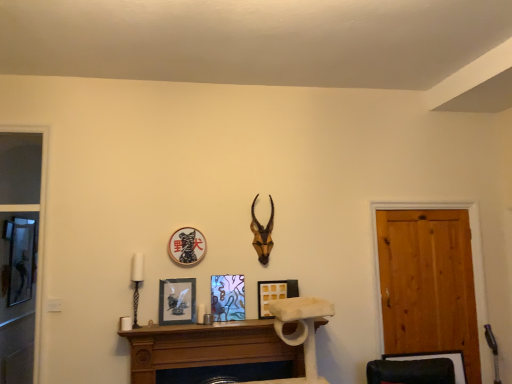
Question: Is brown wooden antler at upper center inside the boundaries of matte black picture frame at center, the fourth picture frame in the right-to-left sequence, or outside?

Choices:
 (A) outside
 (B) inside

Answer: (A)

Question: In terms of width, does brown wooden antler at upper center look wider or thinner when compared to matte black picture frame at center, the fourth picture frame in the right-to-left sequence?

Choices:
 (A) wide
 (B) thin

Answer: (A)

Question: Based on their relative distances, which object is farther from the metallic glass picture frame at center, placed as the 3th picture frame when sorted from left to right?

Choices:
 (A) black matte picture frame at center, the 3th picture frame when ordered from right to left
 (B) brown wooden antler at upper center
 (C) matte black picture frame at center, which is counted as the 1th picture frame, starting from the left
 (D) wooden door at right
 (E) wooden picture frame at center, the fourth picture frame from the left

Answer: (D)

Question: Which object is positioned closest to the wooden mantel at center?

Choices:
 (A) wooden door at right
 (B) white ceramic candle holder at left
 (C) brown wooden antler at upper center
 (D) black matte picture frame at center, the 3th picture frame when ordered from right to left
 (E) metallic glass picture frame at center, placed as the 3th picture frame when sorted from left to right

Answer: (E)